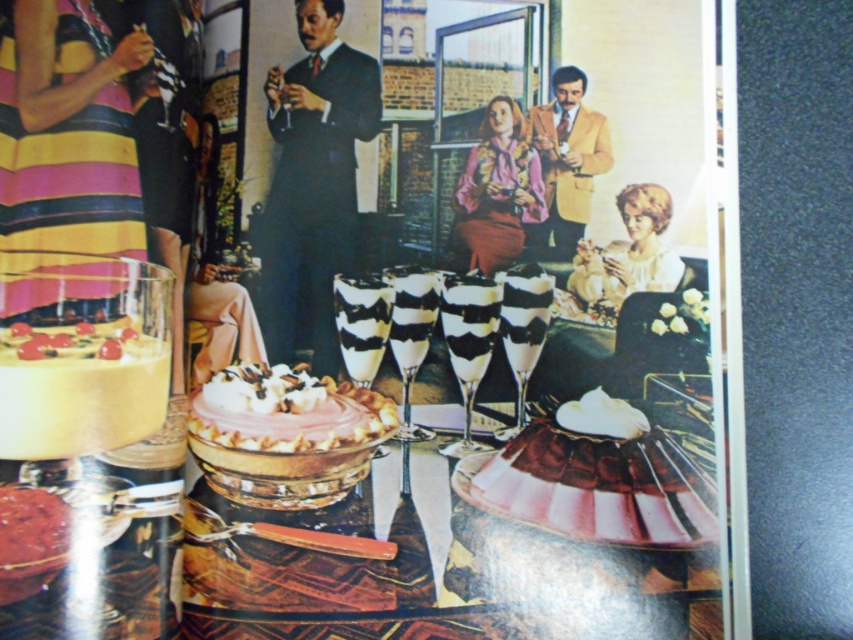
Which is above, shiny glass table at center or smooth black suit at center?

smooth black suit at center is higher up.

Does point (285, 625) lie behind point (339, 230)?

That is False.

The height and width of the screenshot is (640, 853). What are the coordinates of `shiny glass table at center` in the screenshot? It's located at (450, 560).

Locate an element on the screen. shiny glass table at center is located at coordinates (450, 560).

Between pink frosted pie at center and smooth chocolate cake at lower left, which one appears on the right side from the viewer's perspective?

pink frosted pie at center is more to the right.

Between pink frosted pie at center and smooth chocolate cake at lower left, which one has more height?

With more height is pink frosted pie at center.

Locate an element on the screen. This screenshot has height=640, width=853. pink frosted pie at center is located at coordinates (286, 417).

Identify the location of pink frosted pie at center. The width and height of the screenshot is (853, 640). (286, 417).

Is point (640, 449) positioned before point (51, 547)?

No, (640, 449) is further to viewer.

Does velvet pink skirt at lower center come behind smooth chocolate cake at lower left?

Yes, it is behind smooth chocolate cake at lower left.

Between point (604, 522) and point (15, 552), which one is positioned behind?

The point (604, 522) is behind.

Image resolution: width=853 pixels, height=640 pixels. What are the coordinates of `velvet pink skirt at lower center` in the screenshot? It's located at (598, 486).